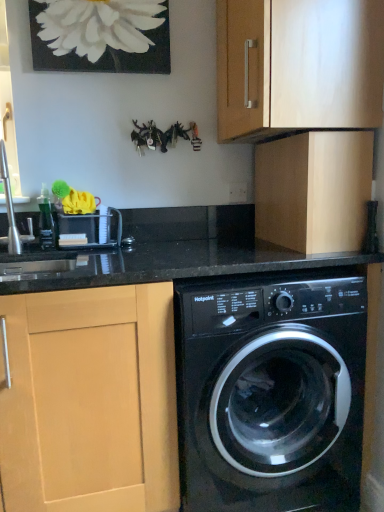
The image size is (384, 512). What do you see at coordinates (90, 400) in the screenshot? I see `light wood cabinet at left, which ranks as the third cabinetry in right-to-left order` at bounding box center [90, 400].

In order to face light wood cabinet at upper right, the 1th cabinetry when ordered from right to left, should I rotate leftwards or rightwards?

A 15.206 degree turn to the right will do.

In order to click on matte wood cabinet at upper center, acting as the 2th cabinetry starting from the right in this screenshot , I will do `click(298, 65)`.

How different are the orientations of black glossy washing machine at lower center and brushed metal faucet at left in degrees?

There is a 0.737-degree angle between the facing directions of black glossy washing machine at lower center and brushed metal faucet at left.

Does black glossy washing machine at lower center touch brushed metal faucet at left?

There is a gap between black glossy washing machine at lower center and brushed metal faucet at left.

From the image's perspective, is black glossy washing machine at lower center below brushed metal faucet at left?

Yes.

Is brushed metal faucet at left looking in the opposite direction of white matte painting at upper center?

No, brushed metal faucet at left is not facing the opposite direction of white matte painting at upper center.

Is brushed metal faucet at left to the right of white matte painting at upper center from the viewer's perspective?

Incorrect, brushed metal faucet at left is not on the right side of white matte painting at upper center.

Is brushed metal faucet at left in front of or behind white matte painting at upper center in the image?

brushed metal faucet at left is in front of white matte painting at upper center.

Are black glossy washing machine at lower center and light wood cabinet at left, the 3th cabinetry positioned from the top, far apart?

black glossy washing machine at lower center is near light wood cabinet at left, the 3th cabinetry positioned from the top, not far away.

Does point (295, 313) appear closer or farther from the camera than point (75, 384)?

Point (295, 313) appears to be farther away from the viewer than point (75, 384).

Is black glossy washing machine at lower center completely or partially outside of light wood cabinet at left, which ranks as the third cabinetry in right-to-left order?

black glossy washing machine at lower center lies outside light wood cabinet at left, which ranks as the third cabinetry in right-to-left order,'s area.

From a real-world perspective, is black glossy washing machine at lower center beneath light wood cabinet at left, the 3th cabinetry positioned from the top?

No.

In the scene shown: Is matte wood cabinet at upper center, acting as the 2th cabinetry starting from the right, far away from black glossy washing machine at lower center?

No, matte wood cabinet at upper center, acting as the 2th cabinetry starting from the right, is in close proximity to black glossy washing machine at lower center.

From a real-world perspective, starting from the black glossy washing machine at lower center, which cabinetry is the 2nd one vertically above it? Please provide its 2D coordinates.

[(298, 65)]

Could you tell me if matte wood cabinet at upper center, placed as the second cabinetry when sorted from left to right, is facing black glossy washing machine at lower center?

No, matte wood cabinet at upper center, placed as the second cabinetry when sorted from left to right, is not oriented towards black glossy washing machine at lower center.

Looking at this image, does matte wood cabinet at upper center, acting as the 2th cabinetry starting from the right, contain black glossy washing machine at lower center?

No, black glossy washing machine at lower center is not surrounded by matte wood cabinet at upper center, acting as the 2th cabinetry starting from the right.

Looking at this image, what's the angular difference between light wood cabinet at upper right, the 2th cabinetry in the top-to-bottom sequence, and black glossy washing machine at lower center's facing directions?

91.5 degrees separate the facing orientations of light wood cabinet at upper right, the 2th cabinetry in the top-to-bottom sequence, and black glossy washing machine at lower center.

Image resolution: width=384 pixels, height=512 pixels. I want to click on washing machine beneath the light wood cabinet at upper right, which is the 3th cabinetry from left to right (from a real-world perspective), so click(271, 393).

Is black glossy washing machine at lower center at the back of light wood cabinet at upper right, the 1th cabinetry when ordered from right to left?

That's not correct — light wood cabinet at upper right, the 1th cabinetry when ordered from right to left, is not looking away from black glossy washing machine at lower center.

Would you consider light wood cabinet at upper right, the 2th cabinetry in the top-to-bottom sequence, to be distant from black glossy washing machine at lower center?

They are positioned close to each other.

At what (x,y) coordinates should I click in order to perform the action: click on washing machine that appears in front of the white matte painting at upper center. Please return your answer as a coordinate pair (x, y). This screenshot has height=512, width=384. Looking at the image, I should click on (271, 393).

Considering the positions of objects black glossy washing machine at lower center and white matte painting at upper center in the image provided, who is in front, black glossy washing machine at lower center or white matte painting at upper center?

black glossy washing machine at lower center is more forward.

Is white matte painting at upper center a part of black glossy washing machine at lower center?

No, white matte painting at upper center is not inside black glossy washing machine at lower center.

Is matte wood cabinet at upper center, placed as the second cabinetry when sorted from left to right, to the left of white matte painting at upper center from the viewer's perspective?

No.

Is white matte painting at upper center surrounded by matte wood cabinet at upper center, which is counted as the 1th cabinetry, starting from the top?

Actually, white matte painting at upper center is outside matte wood cabinet at upper center, which is counted as the 1th cabinetry, starting from the top.

From a real-world perspective, who is located higher, matte wood cabinet at upper center, acting as the 2th cabinetry starting from the right, or white matte painting at upper center?

white matte painting at upper center is physically above.

Find the location of a particular element. faucet above the black glossy washing machine at lower center (from the image's perspective) is located at coordinates (9, 206).

In order to click on faucet in front of the white matte painting at upper center in this screenshot , I will do `click(9, 206)`.

When comparing their distances from light wood cabinet at left, which ranks as the third cabinetry in right-to-left order, does black glossy washing machine at lower center or white matte painting at upper center seem further?

white matte painting at upper center.

Considering their positions, is light wood cabinet at left, the 3th cabinetry positioned from the top, positioned further to light wood cabinet at upper right, the 1th cabinetry when ordered from right to left, than brushed metal faucet at left?

The object further to light wood cabinet at upper right, the 1th cabinetry when ordered from right to left, is brushed metal faucet at left.

Which object lies nearer to the anchor point white matte painting at upper center, light wood cabinet at upper right, the second cabinetry from the bottom, or light wood cabinet at left, which ranks as the third cabinetry in right-to-left order?

light wood cabinet at upper right, the second cabinetry from the bottom.

Considering their positions, is matte wood cabinet at upper center, the third cabinetry ordered from the bottom, positioned closer to light wood cabinet at upper right, which is the 3th cabinetry from left to right, than black glossy washing machine at lower center?

matte wood cabinet at upper center, the third cabinetry ordered from the bottom, lies closer to light wood cabinet at upper right, which is the 3th cabinetry from left to right, than the other object.

From the image, which object appears to be nearer to light wood cabinet at upper right, the second cabinetry from the bottom, white matte painting at upper center or black glossy washing machine at lower center?

black glossy washing machine at lower center.

From the image, which object appears to be nearer to black glossy washing machine at lower center, brushed metal faucet at left or light wood cabinet at upper right, the 2th cabinetry in the top-to-bottom sequence?

light wood cabinet at upper right, the 2th cabinetry in the top-to-bottom sequence, is closer to black glossy washing machine at lower center.

From the picture: When comparing their distances from white matte painting at upper center, does matte wood cabinet at upper center, placed as the second cabinetry when sorted from left to right, or light wood cabinet at left, which ranks as the first cabinetry in bottom-to-top order, seem further?

Among the two, light wood cabinet at left, which ranks as the first cabinetry in bottom-to-top order, is located further to white matte painting at upper center.

Estimate the real-world distances between objects in this image. Which object is closer to light wood cabinet at upper right, the second cabinetry from the bottom, light wood cabinet at left, the first cabinetry from the left, or matte wood cabinet at upper center, placed as the second cabinetry when sorted from left to right?

Based on the image, matte wood cabinet at upper center, placed as the second cabinetry when sorted from left to right, appears to be nearer to light wood cabinet at upper right, the second cabinetry from the bottom.

The height and width of the screenshot is (512, 384). I want to click on washing machine between brushed metal faucet at left and light wood cabinet at upper right, which is the 3th cabinetry from left to right, so click(271, 393).

You are a GUI agent. You are given a task and a screenshot of the screen. Output one action in this format:
    pyautogui.click(x=<x>, y=<y>)
    Task: Click on the faucet between white matte painting at upper center and black glossy washing machine at lower center from top to bottom
    This screenshot has height=512, width=384.
    Given the screenshot: What is the action you would take?
    pyautogui.click(x=9, y=206)

This screenshot has height=512, width=384. I want to click on cabinetry between matte wood cabinet at upper center, placed as the second cabinetry when sorted from left to right, and light wood cabinet at left, which ranks as the third cabinetry in right-to-left order, in the vertical direction, so click(314, 190).

Image resolution: width=384 pixels, height=512 pixels. Identify the location of washing machine between light wood cabinet at left, the 3th cabinetry positioned from the top, and light wood cabinet at upper right, the 1th cabinetry when ordered from right to left. (271, 393).